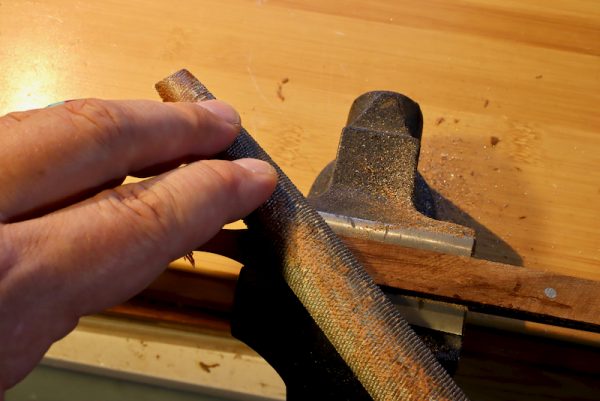
I want to click on wooden surface, so click(560, 101).